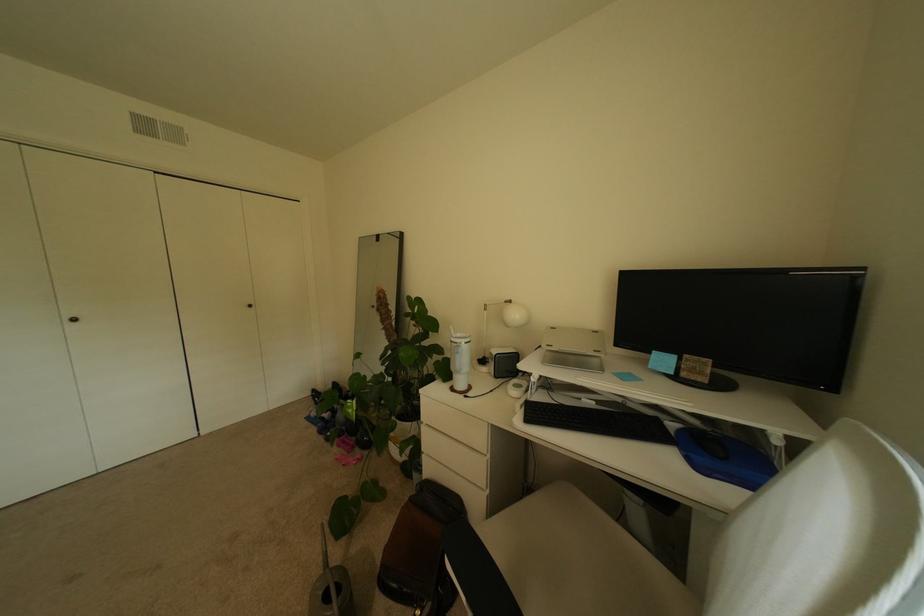
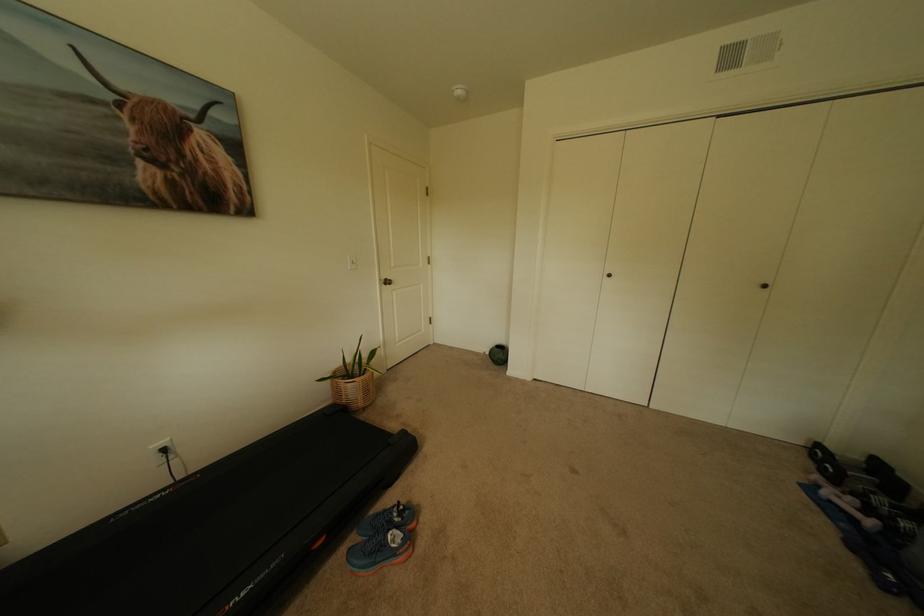
Locate, in the second image, the point that corresponds to the point at 322,395 in the first image.

(827, 452)